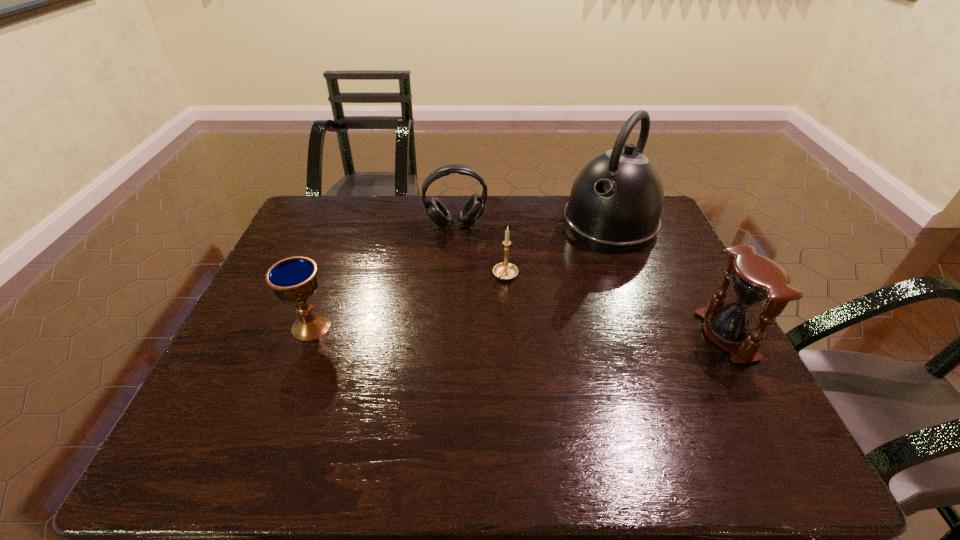
This screenshot has width=960, height=540. Identify the location of free space on the desktop that is between the leftmost object and the hourglass and is positioned on the earcups of the fourth object from right to left. (474, 330).

Where is `free space on the desktop that is between the chalice and the hourglass and is positioned on the handle side of the candle holder`? This screenshot has width=960, height=540. free space on the desktop that is between the chalice and the hourglass and is positioned on the handle side of the candle holder is located at coordinates (479, 330).

Find the location of a particular element. vacant spot on the desktop that is between the chalice and the hourglass and is positioned on the spout of the kettle is located at coordinates (519, 331).